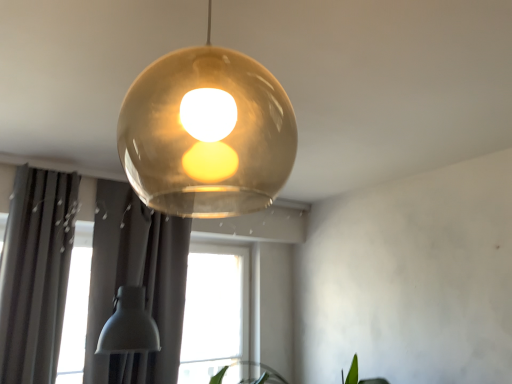
Question: Can you confirm if matte gray curtain at lower left, the 1th curtain from the right, is positioned to the left of translucent amber sphere at center?

Choices:
 (A) no
 (B) yes

Answer: (B)

Question: Could you tell me if matte gray curtain at lower left, the 1th curtain from the right, is turned towards translucent amber sphere at center?

Choices:
 (A) no
 (B) yes

Answer: (B)

Question: Does matte gray curtain at lower left, the 2th curtain from the left, have a larger size compared to translucent amber sphere at center?

Choices:
 (A) no
 (B) yes

Answer: (B)

Question: From the image's perspective, is matte gray curtain at lower left, the 1th curtain from the right, above translucent amber sphere at center?

Choices:
 (A) yes
 (B) no

Answer: (B)

Question: Considering the relative sizes of matte gray curtain at lower left, the 2th curtain from the left, and translucent amber sphere at center in the image provided, is matte gray curtain at lower left, the 2th curtain from the left, smaller than translucent amber sphere at center?

Choices:
 (A) yes
 (B) no

Answer: (B)

Question: Do you think dark gray fabric curtain at left, marked as the 2th curtain in a right-to-left arrangement, is within matte gray curtain at lower left, the 2th curtain from the left, or outside of it?

Choices:
 (A) inside
 (B) outside

Answer: (B)

Question: In terms of width, does dark gray fabric curtain at left, marked as the 2th curtain in a right-to-left arrangement, look wider or thinner when compared to matte gray curtain at lower left, the 2th curtain from the left?

Choices:
 (A) wide
 (B) thin

Answer: (A)

Question: Considering their positions, is dark gray fabric curtain at left, arranged as the 1th curtain when viewed from the left, located in front of or behind matte gray curtain at lower left, the 1th curtain from the right?

Choices:
 (A) front
 (B) behind

Answer: (A)

Question: Is dark gray fabric curtain at left, marked as the 2th curtain in a right-to-left arrangement, bigger or smaller than matte gray curtain at lower left, the 1th curtain from the right?

Choices:
 (A) small
 (B) big

Answer: (A)

Question: From a real-world perspective, is translucent amber sphere at center physically located above or below dark gray fabric curtain at left, arranged as the 1th curtain when viewed from the left?

Choices:
 (A) below
 (B) above

Answer: (B)

Question: Looking at the image, does translucent amber sphere at center seem bigger or smaller compared to dark gray fabric curtain at left, marked as the 2th curtain in a right-to-left arrangement?

Choices:
 (A) small
 (B) big

Answer: (A)

Question: Visually, is translucent amber sphere at center positioned to the left or to the right of dark gray fabric curtain at left, arranged as the 1th curtain when viewed from the left?

Choices:
 (A) left
 (B) right

Answer: (B)

Question: Is point (219, 87) positioned closer to the camera than point (26, 172)?

Choices:
 (A) closer
 (B) farther

Answer: (A)

Question: Would you say dark gray fabric curtain at left, arranged as the 1th curtain when viewed from the left, is to the left or to the right of green leafy plant at lower right in the picture?

Choices:
 (A) right
 (B) left

Answer: (B)

Question: From the image's perspective, relative to green leafy plant at lower right, is dark gray fabric curtain at left, marked as the 2th curtain in a right-to-left arrangement, above or below?

Choices:
 (A) above
 (B) below

Answer: (A)